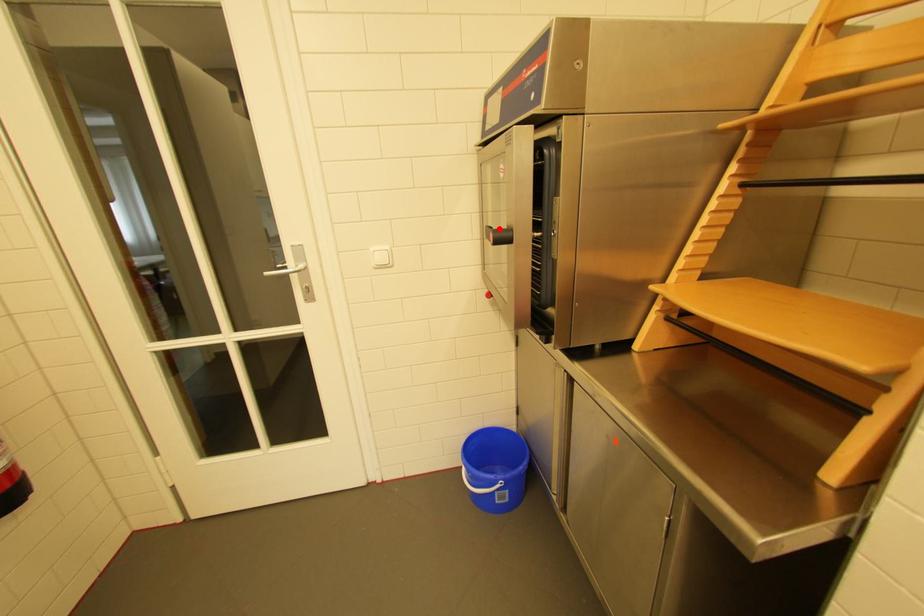
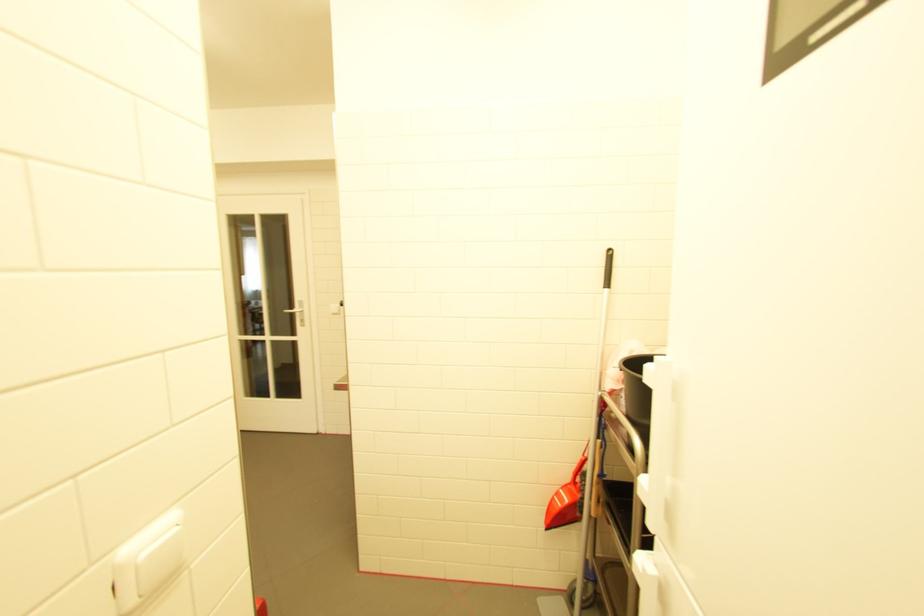
Question: I am providing you with two images of the same scene from different viewpoints. A red point is marked on the first image. At the location where the point appears in image 1, is it still visible in image 2?

Choices:
 (A) Yes
 (B) No

Answer: (B)